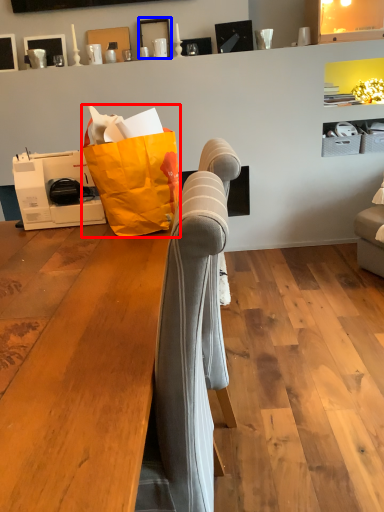
Question: Among these objects, which one is nearest to the camera, grocery bag (highlighted by a red box) or picture frame (highlighted by a blue box)?

Choices:
 (A) grocery bag
 (B) picture frame

Answer: (A)